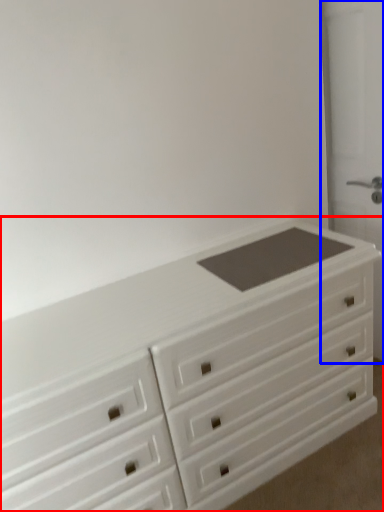
Question: Which point is further to the camera, chest of drawers (highlighted by a red box) or screen door (highlighted by a blue box)?

Choices:
 (A) chest of drawers
 (B) screen door

Answer: (B)